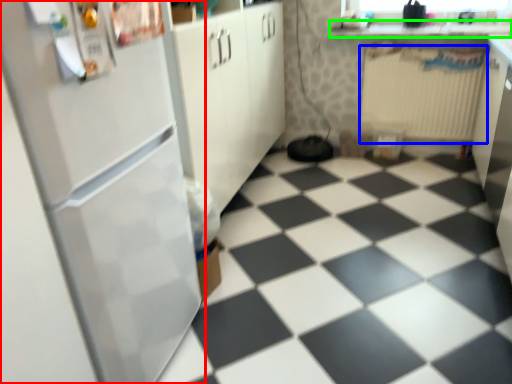
Question: Which is farther away from refrigerator (highlighted by a red box)? radiator (highlighted by a blue box) or counter top (highlighted by a green box)?

Choices:
 (A) radiator
 (B) counter top

Answer: (B)